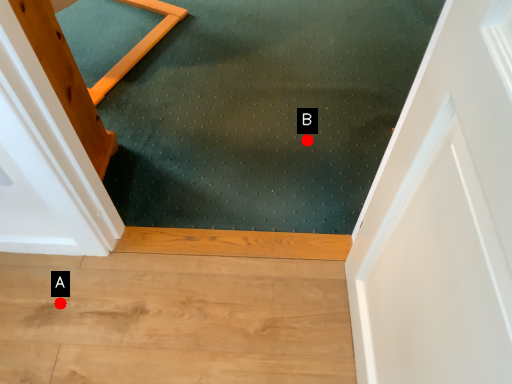
Question: Two points are circled on the image, labeled by A and B beside each circle. Which point appears farthest from the camera in this image?

Choices:
 (A) A is further
 (B) B is further

Answer: (B)